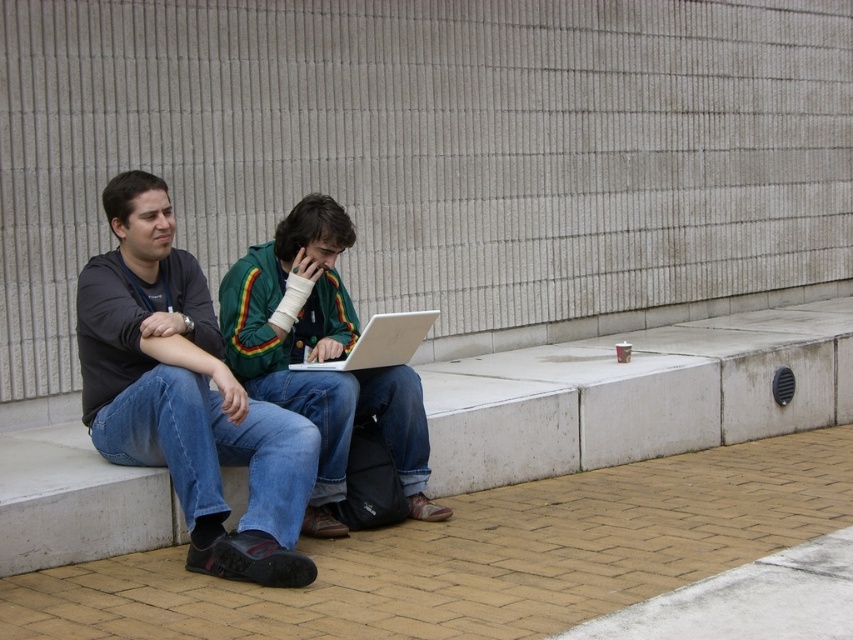
You are a delivery person trying to place a package on the brick pavement at lower center and the white concrete ledge at center. According to the scene, which surface is located to the left of the other?

The brick pavement at lower center is positioned on the left side of white concrete ledge at center, so the brick pavement at lower center is to the left of the white concrete ledge at center.

You are a photographer trying to capture the perfect shot of the green textured jacket at center. Based on the coordinates provided, where should you position your camera to ensure the jacket is centered in the frame?

To center the green textured jacket at center in the frame, position the camera so that the jacket is located at the coordinates point [320,356].

You are a delivery robot that needs to place a small package on the brick pavement at lower center. The package is 0.5 meters in length. Can you safely place it there without hitting the silver metallic laptop at center?

The brick pavement at lower center is 1.27 meters away from the silver metallic laptop at center. Since the package is only 0.5 meters long, placing it on the brick pavement at lower center would leave enough space between it and the laptop, so yes, you can safely place the package there.